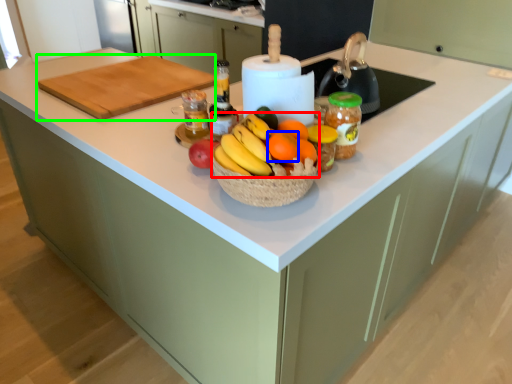
Question: Considering the real-world distances, which object is closest to grapefruit (highlighted by a red box)? orange (highlighted by a blue box) or cutting board (highlighted by a green box).

Choices:
 (A) orange
 (B) cutting board

Answer: (A)